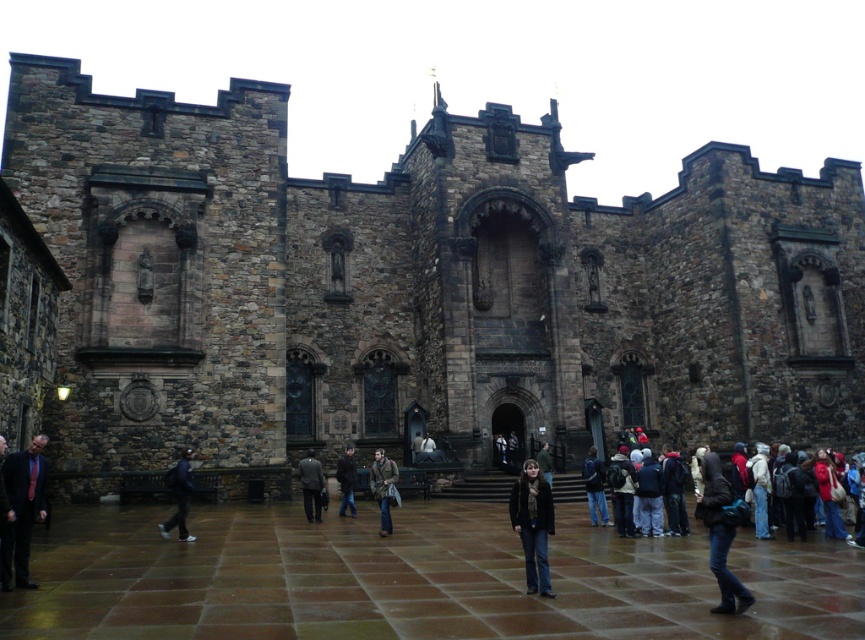
Question: Which point is closer to the camera?

Choices:
 (A) (10, 548)
 (B) (377, 492)

Answer: (A)

Question: Does brown stone castle at center appear under dark blue jacket at lower left?

Choices:
 (A) no
 (B) yes

Answer: (A)

Question: Does blue denim jeans at lower center have a smaller size compared to dark gray wool coat at center?

Choices:
 (A) no
 (B) yes

Answer: (A)

Question: Which of the following is the closest to the observer?

Choices:
 (A) (718, 470)
 (B) (18, 531)

Answer: (B)

Question: Which of the following is the farthest from the observer?

Choices:
 (A) (546, 444)
 (B) (383, 470)

Answer: (A)

Question: Is denim jeans at lower right below brown leather jacket at center?

Choices:
 (A) no
 (B) yes

Answer: (A)